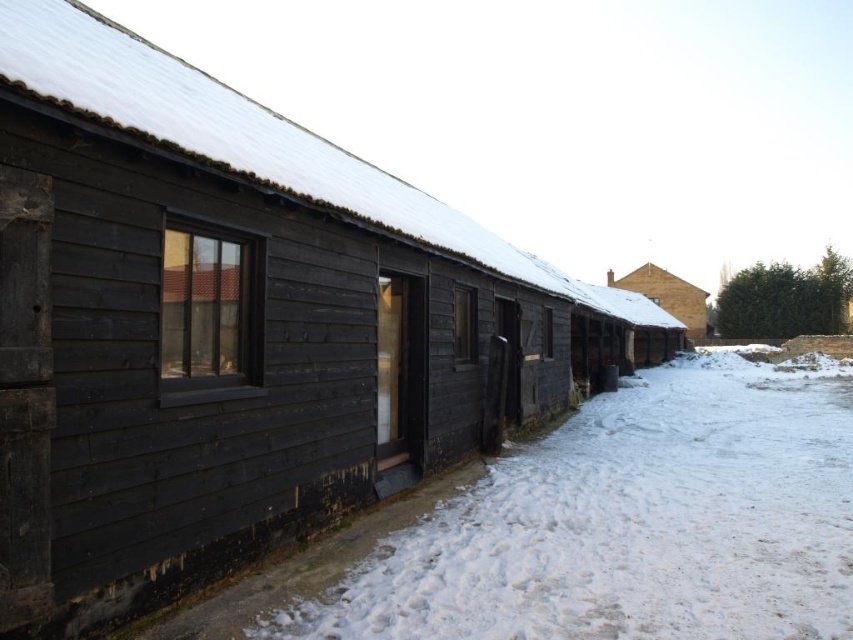
Question: Where is white powdery snow at lower center located in relation to brown textured brick hut at center in the image?

Choices:
 (A) right
 (B) left

Answer: (B)

Question: Does white powdery snow at lower center appear under brown textured brick hut at center?

Choices:
 (A) yes
 (B) no

Answer: (A)

Question: Is white powdery snow at lower center above brown textured brick hut at center?

Choices:
 (A) yes
 (B) no

Answer: (B)

Question: Which point is farther from the camera taking this photo?

Choices:
 (A) (618, 284)
 (B) (440, 564)

Answer: (A)

Question: Among these points, which one is nearest to the camera?

Choices:
 (A) (653, 268)
 (B) (436, 561)

Answer: (B)